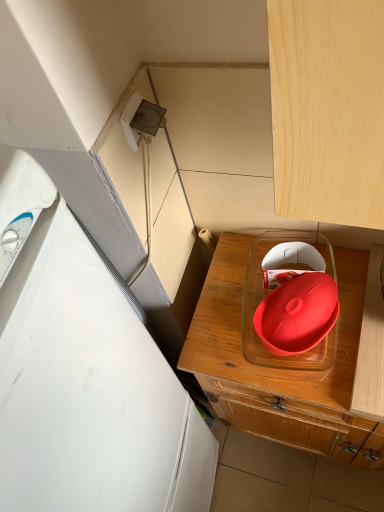
Question: Is matte plastic tray at center taller or shorter than white plastic refrigerator at left?

Choices:
 (A) short
 (B) tall

Answer: (A)

Question: Is matte plastic tray at center to the left or to the right of white plastic refrigerator at left in the image?

Choices:
 (A) right
 (B) left

Answer: (A)

Question: Estimate the real-world distances between objects in this image. Which object is farther from the matte plastic tray at center?

Choices:
 (A) rubberized red lid at center
 (B) white plastic refrigerator at left

Answer: (B)

Question: Considering the real-world distances, which object is closest to the white plastic refrigerator at left?

Choices:
 (A) rubberized red lid at center
 (B) matte plastic tray at center

Answer: (B)